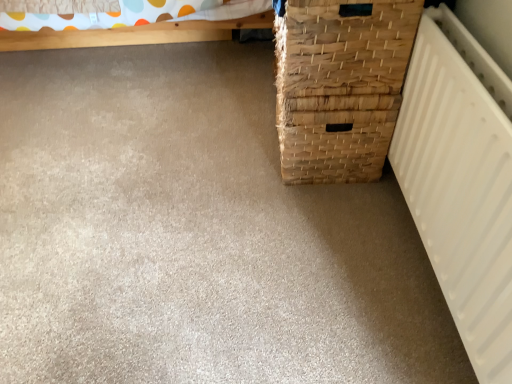
What is the approximate width of natural woven basket at right?

It is 14.20 inches.

What do you see at coordinates (340, 85) in the screenshot? I see `natural woven basket at right` at bounding box center [340, 85].

This screenshot has height=384, width=512. In order to click on natural woven basket at right in this screenshot , I will do `click(340, 85)`.

What do you see at coordinates (461, 182) in the screenshot? I see `white matte radiator at right` at bounding box center [461, 182].

Locate an element on the screen. The width and height of the screenshot is (512, 384). white matte radiator at right is located at coordinates (461, 182).

Where is `natural woven basket at right`? natural woven basket at right is located at coordinates (340, 85).

Does white matte radiator at right appear on the left side of natural woven basket at right?

In fact, white matte radiator at right is to the right of natural woven basket at right.

Is white matte radiator at right in front of natural woven basket at right?

Yes, the depth of white matte radiator at right is less than that of natural woven basket at right.

Which point is more distant from viewer, (480, 198) or (385, 118)?

The point (385, 118) is farther from the camera.

From the image's perspective, between white matte radiator at right and natural woven basket at right, who is located below?

white matte radiator at right, from the image's perspective.

From a real-world perspective, which object stands above the other?

In real-world perspective, white matte radiator at right is above.

In terms of width, does white matte radiator at right look wider or thinner when compared to natural woven basket at right?

In the image, white matte radiator at right appears to be more narrow than natural woven basket at right.

Considering the sizes of objects white matte radiator at right and natural woven basket at right in the image provided, who is shorter, white matte radiator at right or natural woven basket at right?

With less height is natural woven basket at right.

Considering the sizes of objects white matte radiator at right and natural woven basket at right in the image provided, who is bigger, white matte radiator at right or natural woven basket at right?

Bigger between the two is natural woven basket at right.

Can we say white matte radiator at right lies outside natural woven basket at right?

Absolutely, white matte radiator at right is external to natural woven basket at right.

Can you see white matte radiator at right touching natural woven basket at right?

No, white matte radiator at right is not making contact with natural woven basket at right.

Is white matte radiator at right looking in the opposite direction of natural woven basket at right?

No, white matte radiator at right's orientation is not away from natural woven basket at right.

At what (x,y) coordinates should I click in order to perform the action: click on basket container on the left of white matte radiator at right. Please return your answer as a coordinate pair (x, y). Image resolution: width=512 pixels, height=384 pixels. Looking at the image, I should click on (340, 85).

Is natural woven basket at right to the left of white matte radiator at right from the viewer's perspective?

Yes, natural woven basket at right is to the left of white matte radiator at right.

Is natural woven basket at right in front of or behind white matte radiator at right in the image?

Clearly, natural woven basket at right is behind white matte radiator at right.

Which is behind, point (319, 6) or point (505, 236)?

The point (319, 6) is farther.

From the image's perspective, is natural woven basket at right located above white matte radiator at right?

Yes, from the image's perspective, natural woven basket at right is above white matte radiator at right.

In the scene shown: From a real-world perspective, relative to white matte radiator at right, is natural woven basket at right vertically above or below?

From a real-world perspective, natural woven basket at right is physically below white matte radiator at right.

Is natural woven basket at right thinner than white matte radiator at right?

No.

Considering the sizes of objects natural woven basket at right and white matte radiator at right in the image provided, who is shorter, natural woven basket at right or white matte radiator at right?

natural woven basket at right.

Considering the sizes of objects natural woven basket at right and white matte radiator at right in the image provided, who is bigger, natural woven basket at right or white matte radiator at right?

With larger size is natural woven basket at right.

Consider the image. Would you say natural woven basket at right is outside white matte radiator at right?

Yes, natural woven basket at right is not within white matte radiator at right.

Are natural woven basket at right and white matte radiator at right beside each other?

No.

Could you tell me if natural woven basket at right is turned towards white matte radiator at right?

No, natural woven basket at right is not turned towards white matte radiator at right.

How different are the orientations of natural woven basket at right and white matte radiator at right in degrees?

They differ by 0.292 degrees in their facing directions.

At what (x,y) coordinates should I click in order to perform the action: click on basket container above the white matte radiator at right (from the image's perspective). Please return your answer as a coordinate pair (x, y). This screenshot has width=512, height=384. Looking at the image, I should click on 340,85.

I want to click on basket container lying on the left of white matte radiator at right, so click(340, 85).

This screenshot has width=512, height=384. Find the location of `basket container that appears behind the white matte radiator at right`. basket container that appears behind the white matte radiator at right is located at coordinates [340, 85].